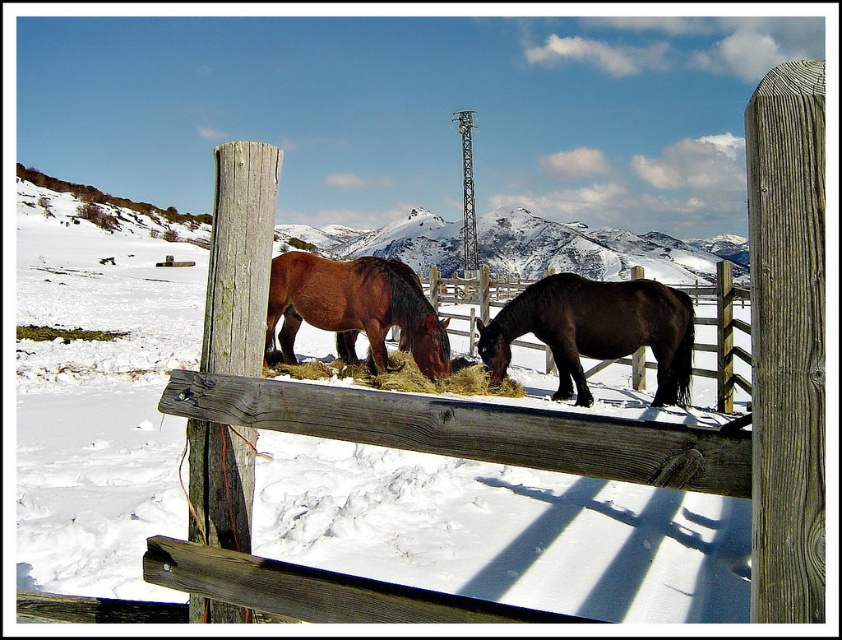
Question: Which is farther from the golden straw at center?

Choices:
 (A) weathered wood post at right
 (B) shiny dark brown horse at center
 (C) weathered wood post at center

Answer: (C)

Question: Can you confirm if shiny dark brown horse at center is wider than brown glossy horse at center?

Choices:
 (A) no
 (B) yes

Answer: (A)

Question: Is white powdery snow at center above brown glossy horse at center?

Choices:
 (A) no
 (B) yes

Answer: (B)

Question: Which of the following is the closest to the observer?

Choices:
 (A) shiny dark brown horse at center
 (B) brown glossy horse at center
 (C) weathered wood post at right

Answer: (C)

Question: Is white powdery snow at center further to the viewer compared to weathered wood post at center?

Choices:
 (A) yes
 (B) no

Answer: (A)

Question: Which object is farther from the camera taking this photo?

Choices:
 (A) weathered wood post at right
 (B) white powdery snow at center
 (C) weathered wood post at center

Answer: (B)